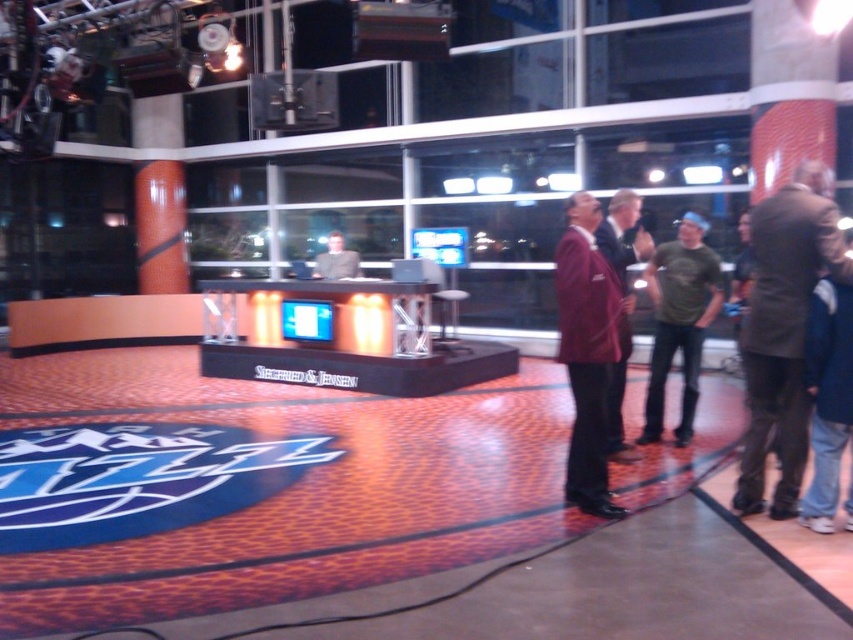
You are a costume designer observing the studio setup. You need to determine which maroon suit is shorter between the maroon fabric suit at right and the maroon wool suit at center. Which one should you select?

The maroon fabric suit at right has a lesser height compared to the maroon wool suit at center, so you should select the maroon fabric suit at right.

You are a stagehand in the NBA studio needing to move a 4.5 meter long banner from the maroon wool suit at center to the matte gray suit at center. Can you fit the banner between them without bending it?

The distance between the maroon wool suit at center and the matte gray suit at center is 4.53 meters, so the 4.5 meter banner can fit between them without bending since it is slightly shorter than the available space.